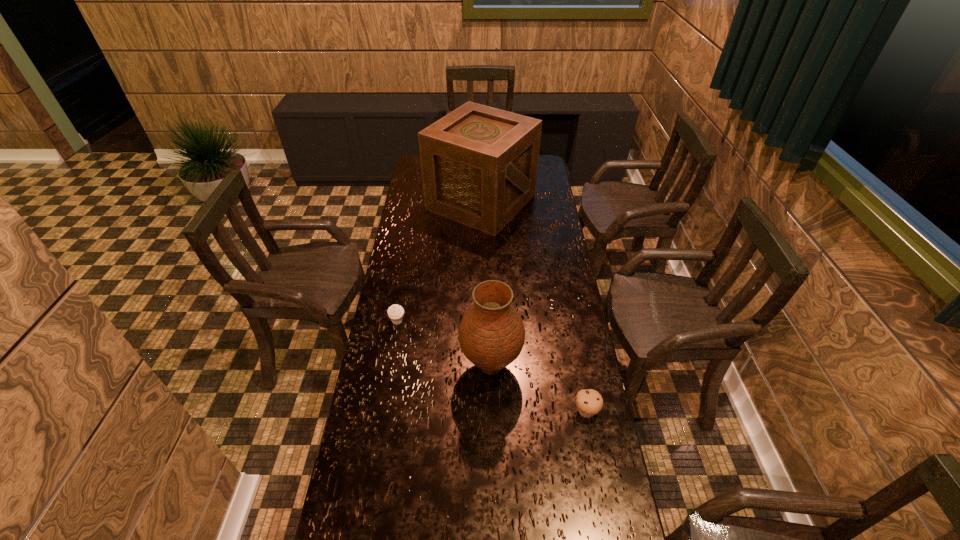
Identify the location of the farthest object. (479, 164).

At what (x,y) coordinates should I click in order to perform the action: click on vase. Please return your answer as a coordinate pair (x, y). The height and width of the screenshot is (540, 960). Looking at the image, I should click on (491, 334).

Locate an element on the screen. Image resolution: width=960 pixels, height=540 pixels. the leftmost object is located at coordinates (395, 312).

Where is `the third nearest object`? the third nearest object is located at coordinates (395, 312).

Find the location of a particular element. The image size is (960, 540). the nearest object is located at coordinates (589, 402).

Where is `the nearer muffin`? The image size is (960, 540). the nearer muffin is located at coordinates (589, 402).

Find the location of a particular element. The image size is (960, 540). vacant space located 0.370m on the front of the box is located at coordinates (482, 294).

Identify the location of vacant region located on the right of the third farthest object. (556, 366).

This screenshot has height=540, width=960. Find the location of `free point located on the back of the left muffin`. free point located on the back of the left muffin is located at coordinates (409, 256).

In order to click on vacant area located 0.200m on the back of the rightmost object in this screenshot , I will do `click(574, 349)`.